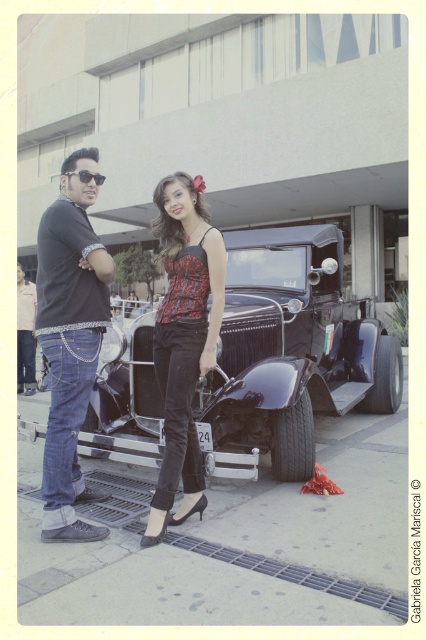
You are a photographer trying to capture a photo of the shiny black car at center and the matte black top at center. Since both are black, you want to ensure you can distinguish them in your photo. Which object should you focus on to make sure it stands out more due to its size?

The shiny black car at center is bigger than the matte black top at center, so focusing on the shiny black car at center will make it stand out more due to its larger size.

You are a photographer setting up a shoot in front of the vintage car. You have to position a matte black top at center and sunglasses at upper left. According to the scene, where should you place the matte black top relative to the sunglasses?

The matte black top at center should be placed below the sunglasses at upper left.